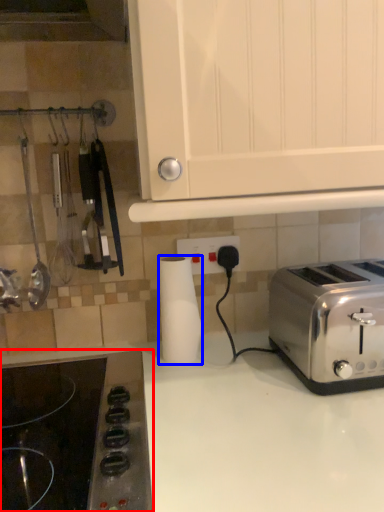
Question: Which object appears farthest to the camera in this image, gas stove (highlighted by a red box) or paper towel (highlighted by a blue box)?

Choices:
 (A) gas stove
 (B) paper towel

Answer: (B)